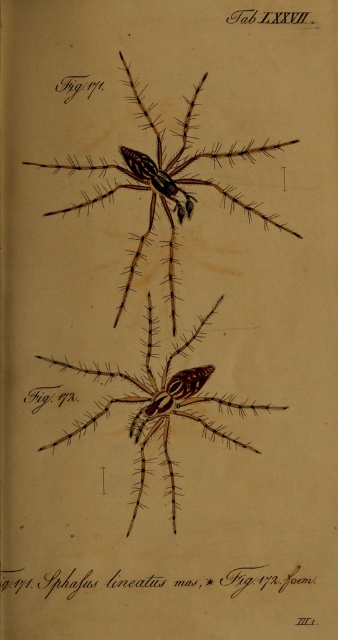
Question: Is brown textured spider at center above brown matte spider at center?

Choices:
 (A) yes
 (B) no

Answer: (A)

Question: Is brown textured spider at center below brown matte spider at center?

Choices:
 (A) no
 (B) yes

Answer: (A)

Question: Among these points, which one is farthest from the camera?

Choices:
 (A) (142, 426)
 (B) (43, 214)

Answer: (A)

Question: Which object appears closest to the camera in this image?

Choices:
 (A) brown matte spider at center
 (B) brown textured spider at center

Answer: (B)

Question: Is brown textured spider at center bigger than brown matte spider at center?

Choices:
 (A) no
 (B) yes

Answer: (B)